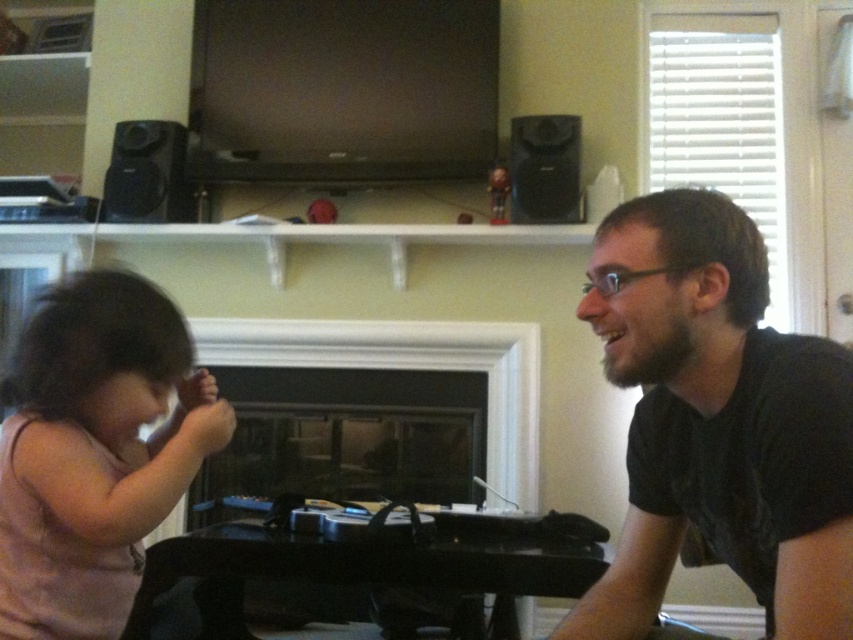
Measure the distance from black matte shirt at right to pink fabric at left.

black matte shirt at right and pink fabric at left are 27.29 inches apart.

Consider the image. Is black matte shirt at right below pink fabric at left?

Correct, black matte shirt at right is located below pink fabric at left.

Where is `black matte shirt at right`? The width and height of the screenshot is (853, 640). black matte shirt at right is located at coordinates (717, 420).